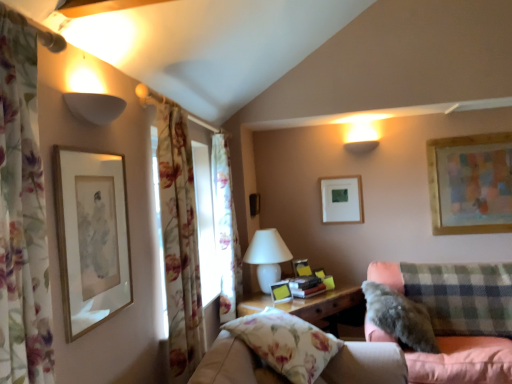
Find the location of a particular element. Image resolution: width=512 pixels, height=384 pixels. free space above wooden-framed artwork at upper right, which is the first picture frame in right-to-left order (from a real-world perspective) is located at coordinates (472, 131).